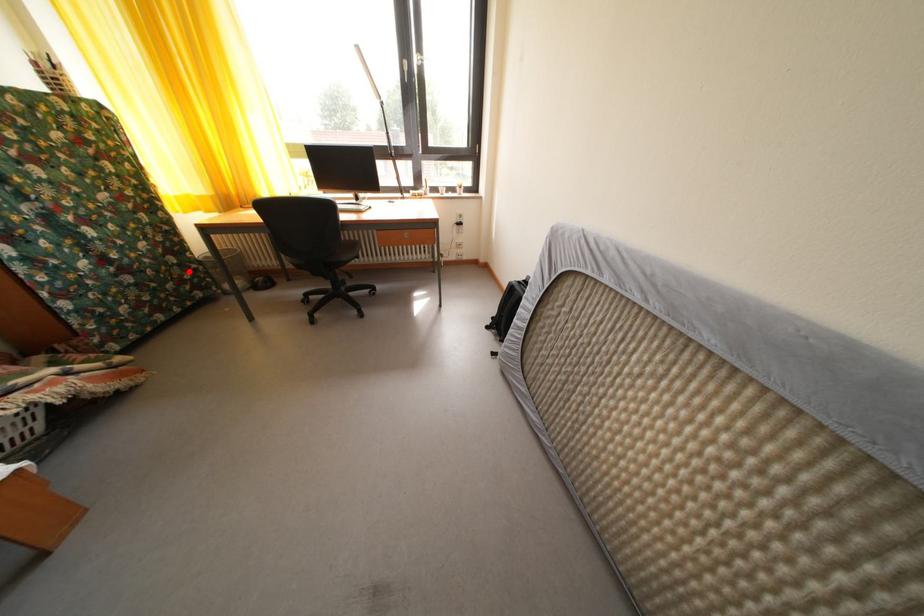
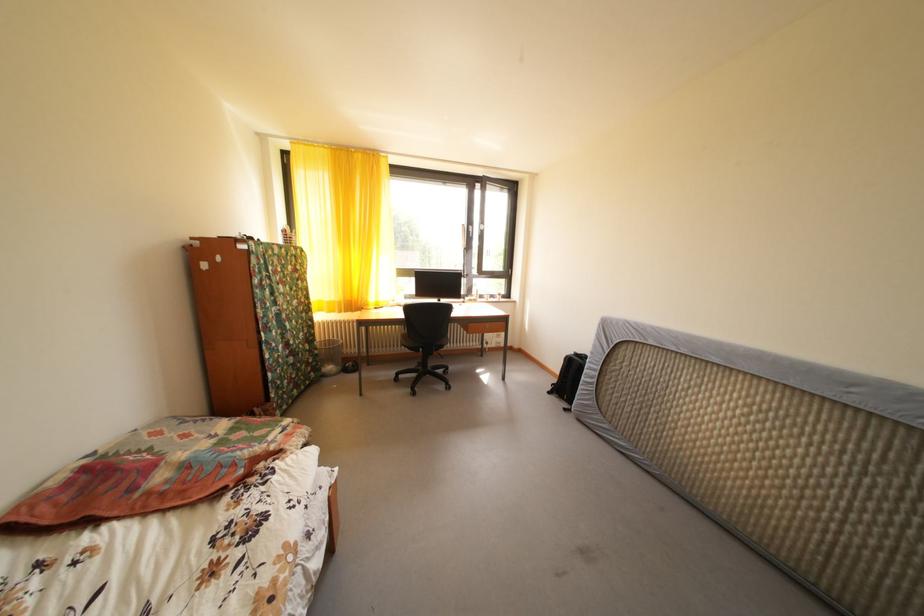
Question: I am providing you with two images of the same scene from different viewpoints. Given a red point in image1, look at the same physical point in image2. Is it:

Choices:
 (A) Closer to the viewpoint
 (B) Farther from the viewpoint

Answer: (A)